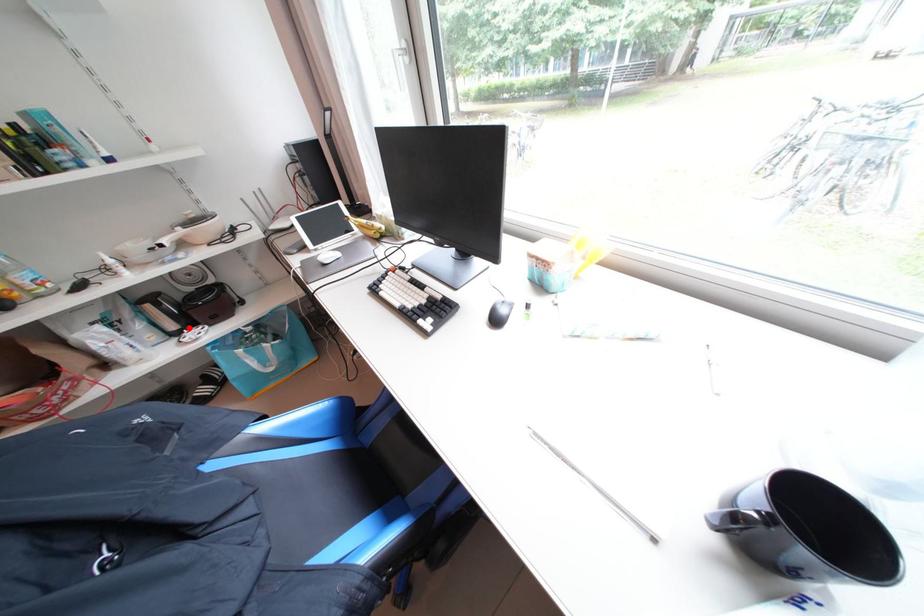
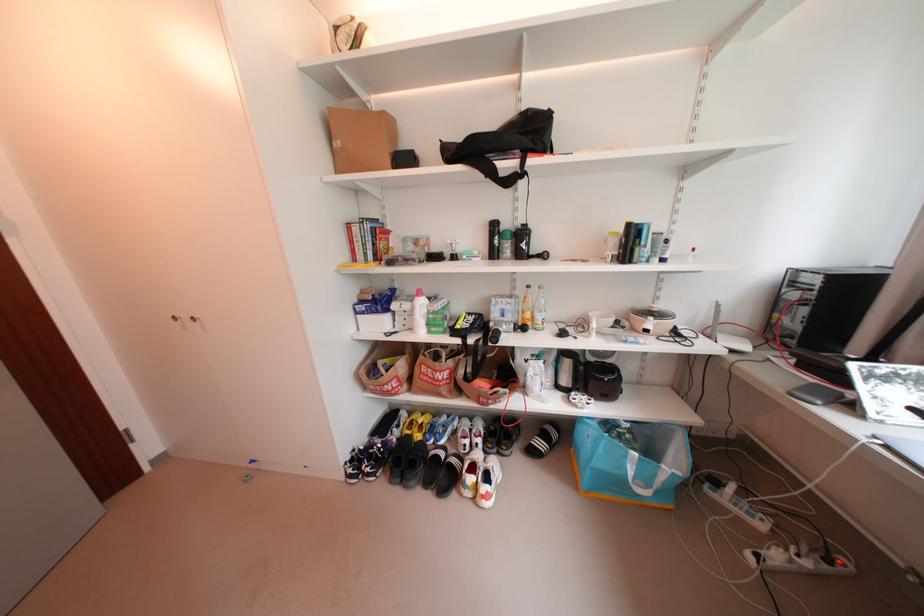
Question: I am providing you with two images of the same scene from different viewpoints. A red point is shown in image1. For the corresponding object point in image2, is it positioned nearer or farther from the camera?

Choices:
 (A) Nearer
 (B) Farther

Answer: (B)